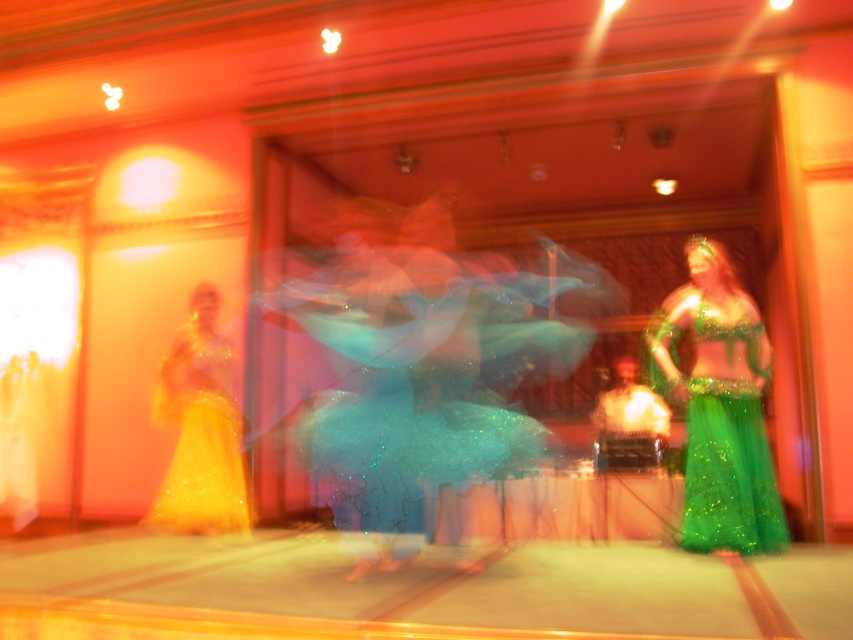
Question: Among these objects, which one is nearest to the camera?

Choices:
 (A) shiny gold dress at left
 (B) green glittery skirt at center

Answer: (B)

Question: Which point is closer to the camera?

Choices:
 (A) green glittery skirt at center
 (B) shiny gold dress at left

Answer: (A)

Question: Is green glittery skirt at center to the right of shiny gold dress at left from the viewer's perspective?

Choices:
 (A) no
 (B) yes

Answer: (B)

Question: Can you confirm if green glittery skirt at center is positioned below shiny gold dress at left?

Choices:
 (A) yes
 (B) no

Answer: (B)

Question: Where is green glittery skirt at center located in relation to shiny gold dress at left in the image?

Choices:
 (A) left
 (B) right

Answer: (B)

Question: Among these points, which one is nearest to the camera?

Choices:
 (A) (724, 522)
 (B) (194, 304)

Answer: (A)